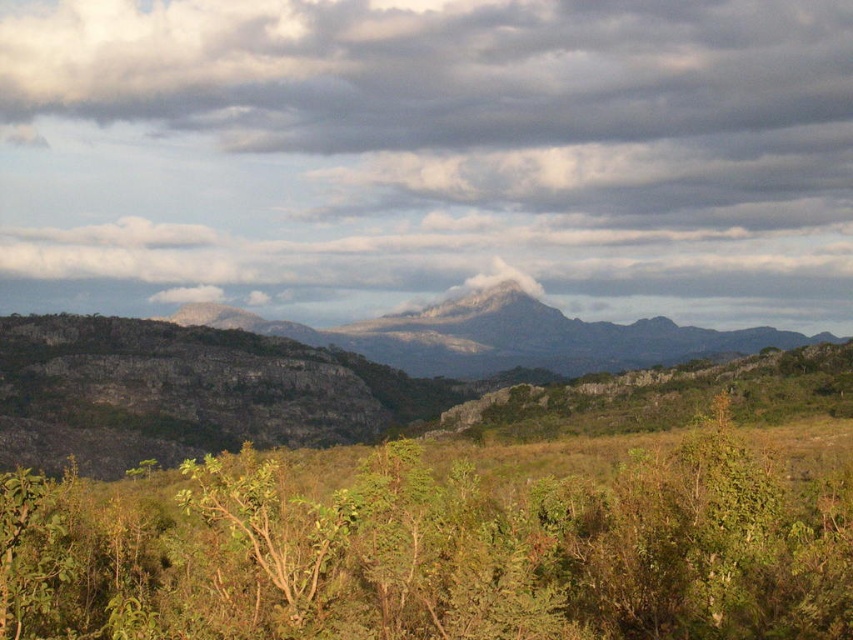
From the picture: Can you confirm if cloudy sky at upper center is bigger than green leafy shrub at lower center?

Correct, cloudy sky at upper center is larger in size than green leafy shrub at lower center.

Does point (126, 36) lie behind point (288, 627)?

Yes, point (126, 36) is farther from viewer.

The height and width of the screenshot is (640, 853). I want to click on cloudy sky at upper center, so click(x=430, y=154).

Looking at this image, which is more to the right, green leafy shrub at lower center or rugged stone mountain at center?

Positioned to the right is rugged stone mountain at center.

Can you confirm if green leafy shrub at lower center is positioned to the left of rugged stone mountain at center?

Indeed, green leafy shrub at lower center is positioned on the left side of rugged stone mountain at center.

Which is behind, point (339, 557) or point (364, 353)?

The point (364, 353) is more distant.

This screenshot has width=853, height=640. Find the location of `green leafy shrub at lower center`. green leafy shrub at lower center is located at coordinates (438, 550).

Is point (850, 310) farther from viewer compared to point (480, 358)?

Yes, point (850, 310) is behind point (480, 358).

Can you confirm if cloudy sky at upper center is shorter than rugged stone mountain at center?

No, cloudy sky at upper center is not shorter than rugged stone mountain at center.

Is point (659, 282) more distant than point (590, 340)?

Yes, point (659, 282) is farther from viewer.

At what (x,y) coordinates should I click in order to perform the action: click on cloudy sky at upper center. Please return your answer as a coordinate pair (x, y). Image resolution: width=853 pixels, height=640 pixels. Looking at the image, I should click on (430, 154).